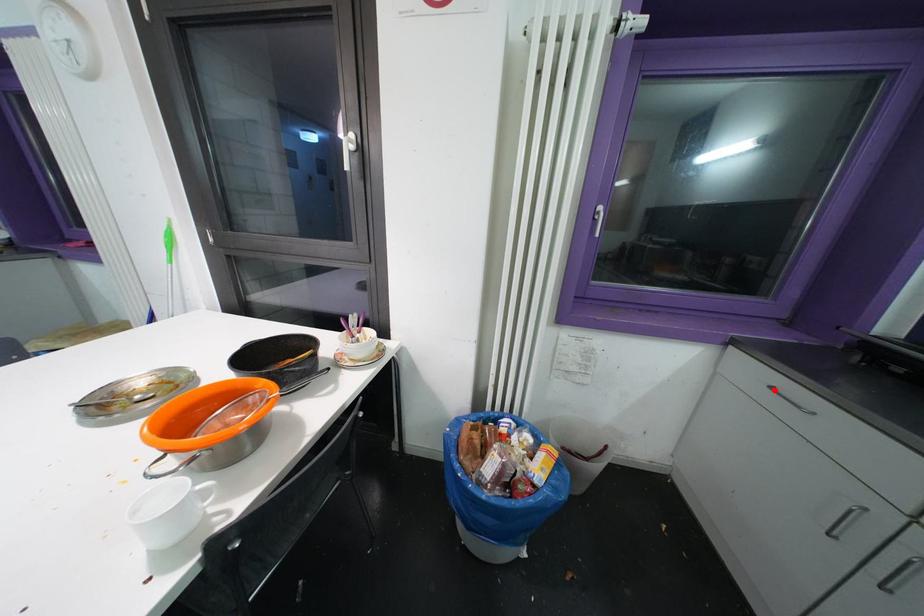
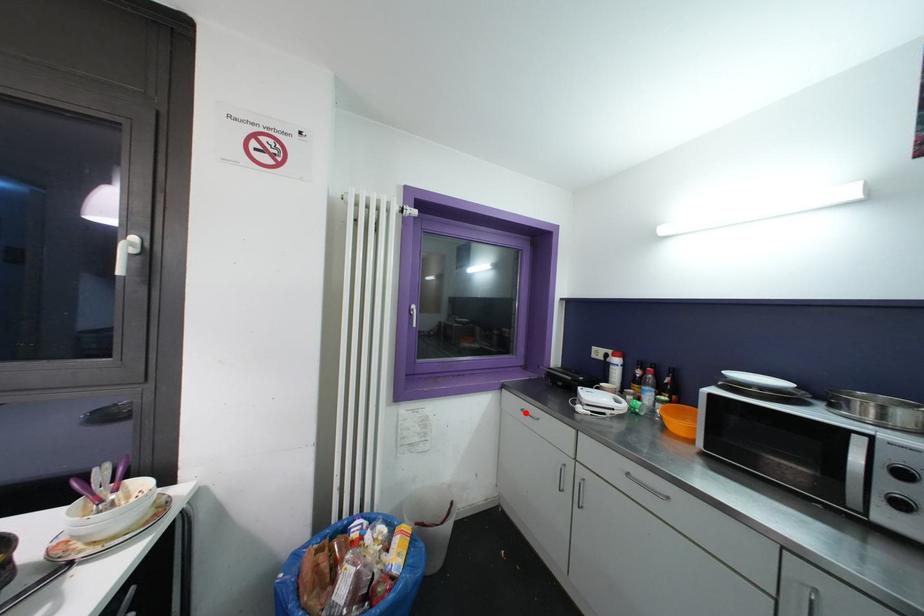
I am providing you with two images of the same scene from different viewpoints. A red point is marked on the first image and another point is marked on the second image. Is the marked point in image1 the same physical position as the marked point in image2?

Yes